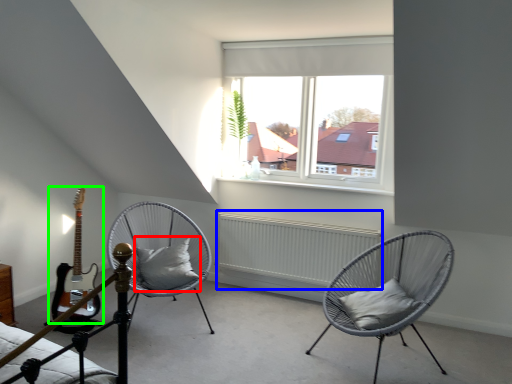
Question: Which is farther away from pillow (highlighted by a red box)? radiator (highlighted by a blue box) or guitar (highlighted by a green box)?

Choices:
 (A) radiator
 (B) guitar

Answer: (A)